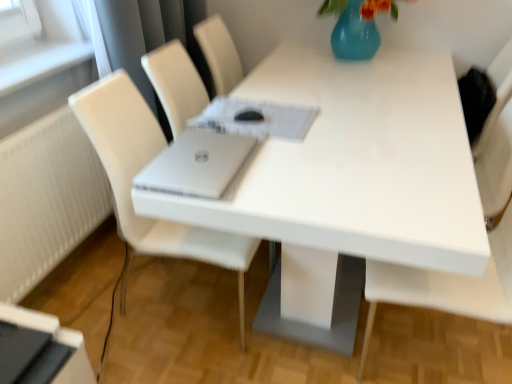
Question: Is black glossy desktop at lower left next to white matte chair at right, which appears as the 1th chair when viewed from the right?

Choices:
 (A) yes
 (B) no

Answer: (B)

Question: Is the depth of black glossy desktop at lower left greater than that of white matte chair at right, which appears as the 1th chair when viewed from the right?

Choices:
 (A) yes
 (B) no

Answer: (A)

Question: Considering the relative sizes of black glossy desktop at lower left and white matte chair at right, which appears as the 1th chair when viewed from the right, in the image provided, is black glossy desktop at lower left taller than white matte chair at right, which appears as the 1th chair when viewed from the right,?

Choices:
 (A) no
 (B) yes

Answer: (A)

Question: Is white matte chair at right, which appears as the 1th chair when viewed from the right, at the back of black glossy desktop at lower left?

Choices:
 (A) no
 (B) yes

Answer: (A)

Question: Is black glossy desktop at lower left smaller than white matte chair at right, which ranks as the second chair in left-to-right order?

Choices:
 (A) no
 (B) yes

Answer: (B)

Question: Considering the relative positions of black glossy desktop at lower left and white matte chair at right, which appears as the 1th chair when viewed from the right, in the image provided, is black glossy desktop at lower left in front of white matte chair at right, which appears as the 1th chair when viewed from the right,?

Choices:
 (A) yes
 (B) no

Answer: (B)

Question: Is white glossy table at center thinner than black glossy desktop at lower left?

Choices:
 (A) no
 (B) yes

Answer: (A)

Question: From the image's perspective, is white glossy table at center located beneath black glossy desktop at lower left?

Choices:
 (A) yes
 (B) no

Answer: (B)

Question: Considering the relative sizes of white glossy table at center and black glossy desktop at lower left in the image provided, is white glossy table at center wider than black glossy desktop at lower left?

Choices:
 (A) no
 (B) yes

Answer: (B)

Question: Considering the relative positions of white glossy table at center and black glossy desktop at lower left in the image provided, is white glossy table at center to the right of black glossy desktop at lower left from the viewer's perspective?

Choices:
 (A) no
 (B) yes

Answer: (B)

Question: Is white glossy table at center positioned in front of black glossy desktop at lower left?

Choices:
 (A) no
 (B) yes

Answer: (B)

Question: Considering the relative positions of white glossy table at center and black glossy desktop at lower left in the image provided, is white glossy table at center behind black glossy desktop at lower left?

Choices:
 (A) no
 (B) yes

Answer: (A)

Question: Is white matte chair at right, which ranks as the second chair in left-to-right order, in front of white glossy table at center?

Choices:
 (A) no
 (B) yes

Answer: (B)